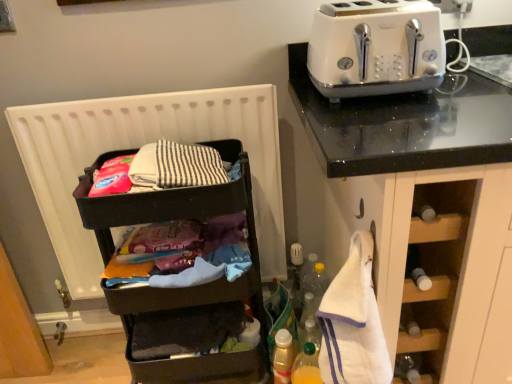
Question: Is translucent plastic bottle at lower center, the second bottle from the right, not within white terry cloth at right?

Choices:
 (A) yes
 (B) no

Answer: (A)

Question: From the image's perspective, does translucent plastic bottle at lower center, placed as the 1th bottle when sorted from left to right, appear lower than white terry cloth at right?

Choices:
 (A) no
 (B) yes

Answer: (B)

Question: Is translucent plastic bottle at lower center, placed as the 1th bottle when sorted from left to right, wider than white terry cloth at right?

Choices:
 (A) yes
 (B) no

Answer: (B)

Question: Does translucent plastic bottle at lower center, placed as the 1th bottle when sorted from left to right, have a smaller size compared to white terry cloth at right?

Choices:
 (A) yes
 (B) no

Answer: (A)

Question: From a real-world perspective, is translucent plastic bottle at lower center, the second bottle from the right, below white terry cloth at right?

Choices:
 (A) no
 (B) yes

Answer: (B)

Question: From the image's perspective, is translucent plastic bottle at lower center, the second bottle from the right, over white terry cloth at right?

Choices:
 (A) yes
 (B) no

Answer: (B)

Question: From the image's perspective, would you say translucent plastic bottle at lower center, the first bottle from the right, is positioned over translucent plastic bottle at lower center, placed as the 1th bottle when sorted from left to right?

Choices:
 (A) yes
 (B) no

Answer: (B)

Question: From a real-world perspective, is translucent plastic bottle at lower center, the second bottle positioned from the left, under translucent plastic bottle at lower center, the second bottle from the right?

Choices:
 (A) yes
 (B) no

Answer: (B)

Question: Is the position of translucent plastic bottle at lower center, the first bottle from the right, less distant than that of translucent plastic bottle at lower center, the second bottle from the right?

Choices:
 (A) no
 (B) yes

Answer: (B)

Question: Are translucent plastic bottle at lower center, the first bottle from the right, and translucent plastic bottle at lower center, placed as the 1th bottle when sorted from left to right, beside each other?

Choices:
 (A) no
 (B) yes

Answer: (B)

Question: Does translucent plastic bottle at lower center, the first bottle from the right, contain translucent plastic bottle at lower center, the second bottle from the right?

Choices:
 (A) no
 (B) yes

Answer: (A)

Question: Is translucent plastic bottle at lower center, the first bottle from the right, bigger than translucent plastic bottle at lower center, the second bottle from the right?

Choices:
 (A) no
 (B) yes

Answer: (B)

Question: Considering the relative positions of white glossy toaster at upper right and translucent plastic bottle at lower center, the second bottle from the right, in the image provided, is white glossy toaster at upper right behind translucent plastic bottle at lower center, the second bottle from the right,?

Choices:
 (A) yes
 (B) no

Answer: (B)